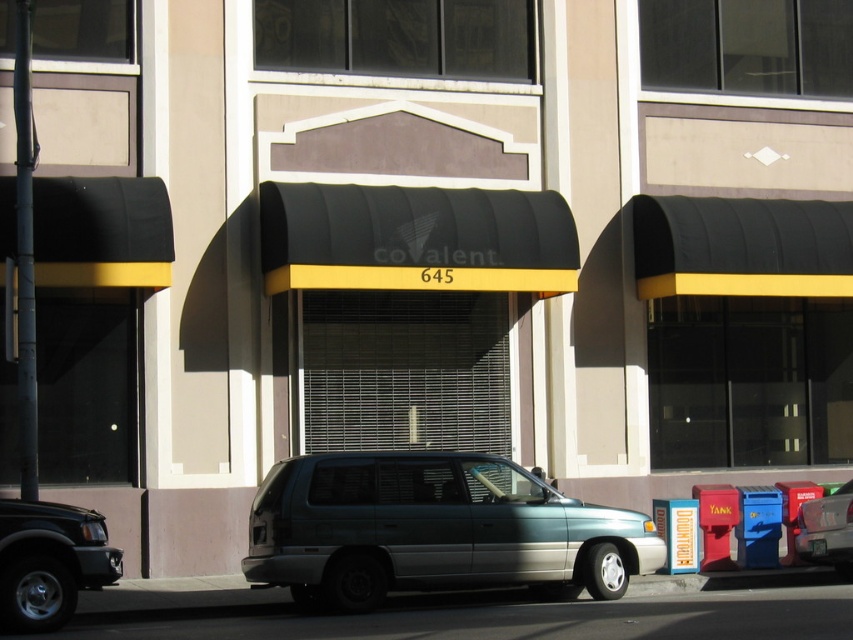
Question: Considering the real-world distances, which object is farthest from the metallic silver minivan at center?

Choices:
 (A) teal matte minivan at center
 (B) matte black suv at lower left

Answer: (B)

Question: Can you confirm if teal matte minivan at center is wider than matte black suv at lower left?

Choices:
 (A) no
 (B) yes

Answer: (B)

Question: Which object is farther from the camera taking this photo?

Choices:
 (A) metallic silver minivan at center
 (B) teal matte minivan at center
 (C) matte black suv at lower left

Answer: (A)

Question: Can you confirm if matte black suv at lower left is wider than metallic silver minivan at center?

Choices:
 (A) no
 (B) yes

Answer: (B)

Question: Observing the image, what is the correct spatial positioning of teal matte minivan at center in reference to matte black suv at lower left?

Choices:
 (A) above
 (B) below

Answer: (B)

Question: Which object is farther from the camera taking this photo?

Choices:
 (A) matte black suv at lower left
 (B) teal matte minivan at center

Answer: (B)